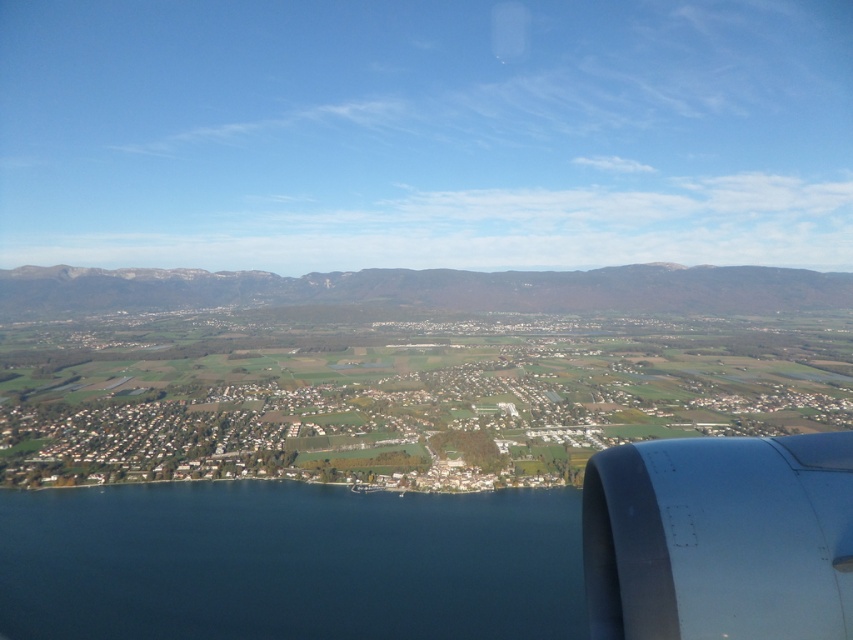
You are a pilot flying at an altitude of 2000 feet and see the point marked at point [288,618] through the airplane window. Based on the scene, can you safely descend to land at that point?

The point marked at point [288,618] is 2004.81 feet away from the viewer, which is slightly higher than the current altitude of 2000 feet. Therefore, descending to land there may not be safe as the aircraft might crash before reaching the point.

You are a pilot trying to determine the safest landing area. Given the image, which area is narrower between the deep blue water at lower left and the rocky gray mountains at center?

The deep blue water at lower left is narrower than the rocky gray mountains at center, so the mountains area is wider and safer for landing.

You are a passenger on an airplane and notice two objects outside your window. You see the deep blue water at lower left and the metallic gray engine at lower right. Which object is located closer to the bottom edge of the window?

The deep blue water at lower left is positioned under the metallic gray engine at lower right, so it is closer to the bottom edge of the window.